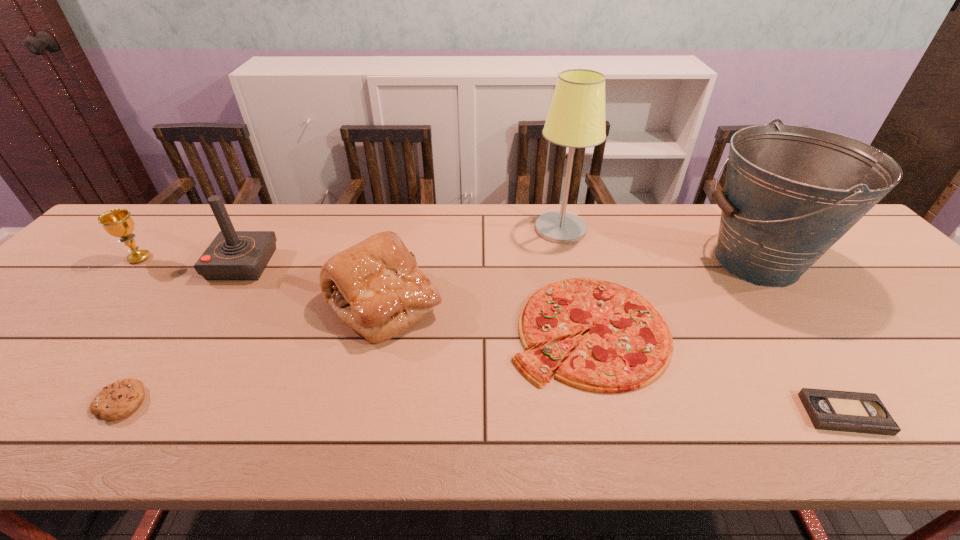
Where is `vacant region located 0.160m with the handle on opposite sides of the bucket`? This screenshot has width=960, height=540. vacant region located 0.160m with the handle on opposite sides of the bucket is located at coordinates (636, 262).

The height and width of the screenshot is (540, 960). Identify the location of vacant space situated 0.300m with the handle on opposite sides of the bucket. (586, 262).

Locate an element on the screen. Image resolution: width=960 pixels, height=540 pixels. vacant space located on the rectangular base of the sixth shortest object is located at coordinates (322, 264).

This screenshot has width=960, height=540. I want to click on vacant position located on the filling side of the fourth object from left to right, so click(x=521, y=303).

You are a GUI agent. You are given a task and a screenshot of the screen. Output one action in this format:
    pyautogui.click(x=<x>, y=<y>)
    Task: Click on the vacant space located 0.150m on the back of the chalice
    The image size is (960, 540).
    Given the screenshot: What is the action you would take?
    pyautogui.click(x=175, y=221)

The width and height of the screenshot is (960, 540). I want to click on blank space located 0.220m on the back of the third shortest object, so click(x=564, y=232).

Locate an element on the screen. This screenshot has width=960, height=540. vacant space located 0.250m on the back of the second shortest object is located at coordinates (194, 299).

Find the location of a particular element. The height and width of the screenshot is (540, 960). vacant region located 0.260m on the back of the videotape is located at coordinates (767, 304).

What are the coordinates of `table lamp present at the far edge` in the screenshot? It's located at (576, 118).

Locate an element on the screen. The image size is (960, 540). bucket that is at the far edge is located at coordinates pyautogui.click(x=791, y=192).